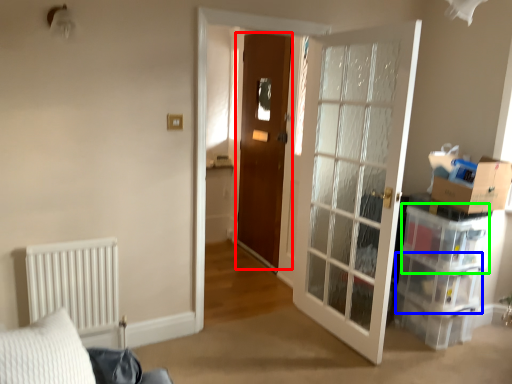
Question: Which object is positioned closest to door (highlighted by a red box)? Select from drawer (highlighted by a blue box) and storage box (highlighted by a green box).

Choices:
 (A) drawer
 (B) storage box

Answer: (B)